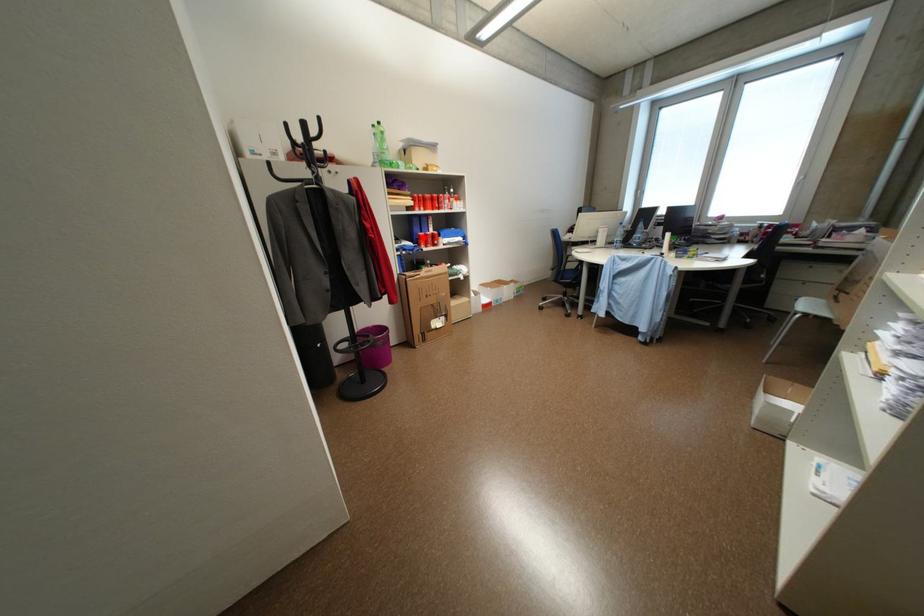
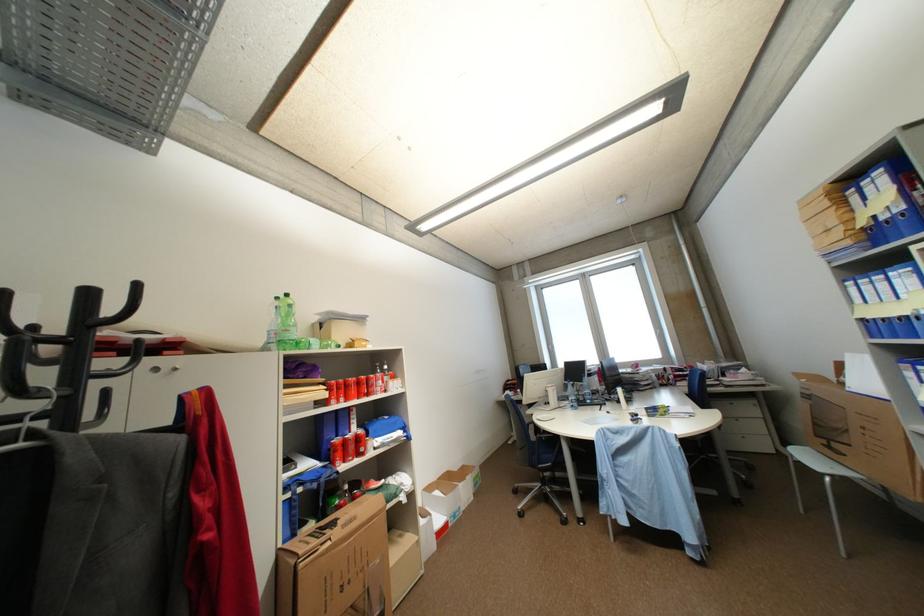
Where in the second image is the point corresponding to the highlighted location from the first image?

(333, 448)